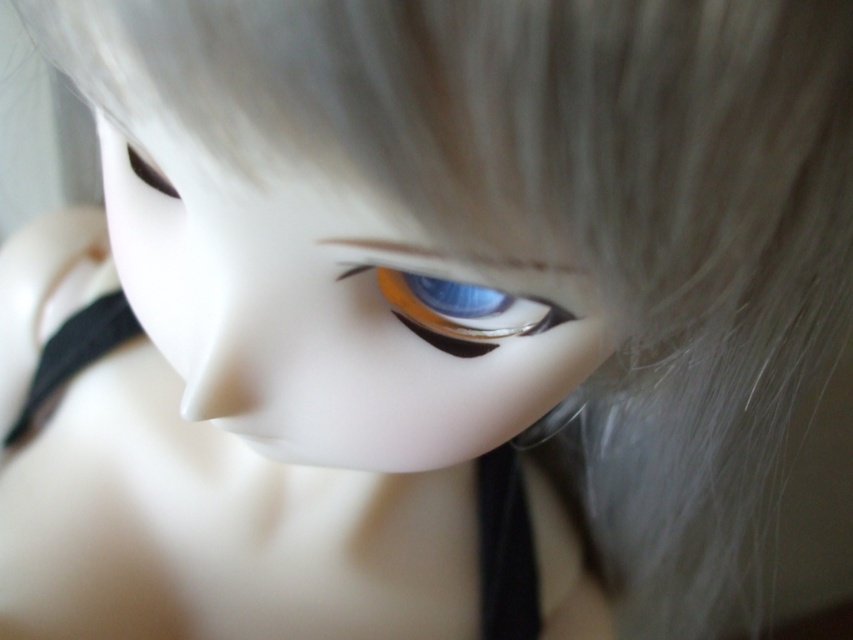
Question: Observing the image, what is the correct spatial positioning of blue glossy eye at center in reference to black matte strap at lower center?

Choices:
 (A) left
 (B) right

Answer: (A)

Question: Which object is farther from the camera taking this photo?

Choices:
 (A) black satin strap at lower left
 (B) black matte strap at lower center
 (C) satin white doll face at center

Answer: (B)

Question: Can you confirm if blue glossy eye at center is positioned below black matte strap at lower center?

Choices:
 (A) yes
 (B) no

Answer: (B)

Question: Which object is closer to the camera taking this photo?

Choices:
 (A) black matte strap at lower center
 (B) blue glossy eye at center

Answer: (B)

Question: Which of these objects is positioned closest to the matte black eye at upper left?

Choices:
 (A) blue glossy eye at center
 (B) black satin strap at lower left

Answer: (A)

Question: Is black matte strap at lower center bigger than black satin strap at lower left?

Choices:
 (A) no
 (B) yes

Answer: (A)